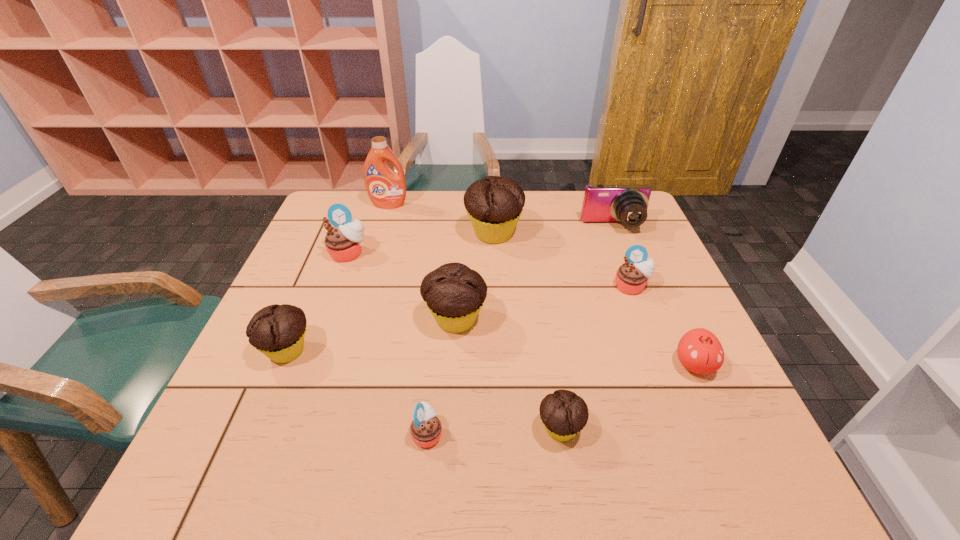
Image resolution: width=960 pixels, height=540 pixels. I want to click on empty space between the second farthest pink muffin and the apple, so click(662, 326).

At what (x,y) coordinates should I click in order to perform the action: click on vacant space that's between the farthest object and the leftmost chocolate muffin. Please return your answer as a coordinate pair (x, y). Looking at the image, I should click on (338, 278).

I want to click on free spot between the second biggest chocolate muffin and the detergent, so click(x=421, y=262).

I want to click on free area in between the smallest pink muffin and the nearest chocolate muffin, so click(x=493, y=431).

Locate an element on the screen. This screenshot has height=540, width=960. free spot between the farthest pink muffin and the nearest pink muffin is located at coordinates (388, 343).

This screenshot has width=960, height=540. I want to click on free space between the detergent and the second nearest pink muffin, so click(x=510, y=246).

I want to click on unoccupied position between the nearest chocolate muffin and the camera, so click(587, 328).

Image resolution: width=960 pixels, height=540 pixels. In order to click on vacant space in between the biggest chocolate muffin and the leftmost chocolate muffin in this screenshot , I will do `click(391, 292)`.

Identify the location of vacant area that lies between the leftmost pink muffin and the red apple. This screenshot has height=540, width=960. (521, 309).

Identify the location of the fourth closest object to the farthest chocolate muffin. The width and height of the screenshot is (960, 540). (631, 277).